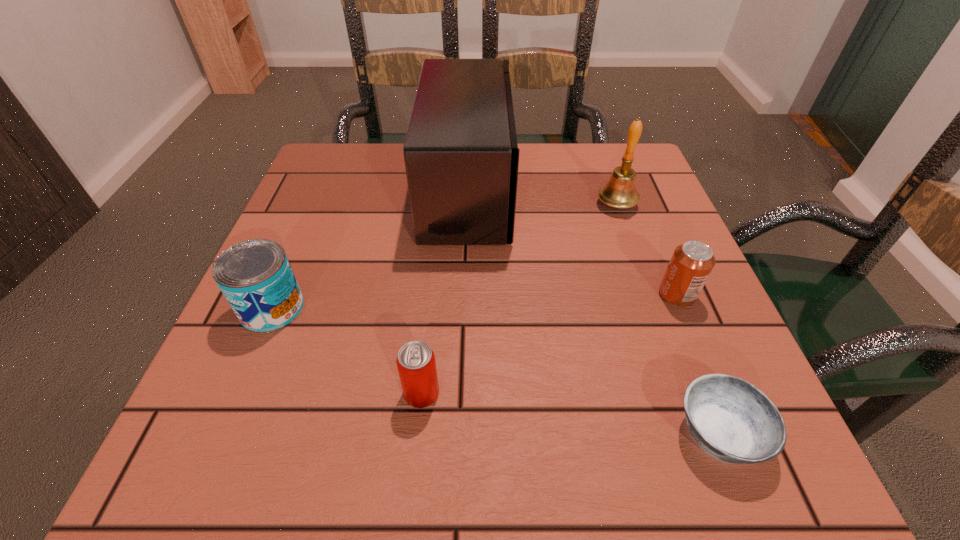
Find the location of a particular element. free space between the bell and the leftmost object is located at coordinates (444, 256).

At what (x,y) coordinates should I click in order to perform the action: click on vacant space that is in between the microwave_oven and the rightmost can. Please return your answer as a coordinate pair (x, y). Looking at the image, I should click on (572, 242).

This screenshot has width=960, height=540. Identify the location of vacant area that lies between the microwave_oven and the second can from right to left. (444, 291).

You are a GUI agent. You are given a task and a screenshot of the screen. Output one action in this format:
    pyautogui.click(x=<x>, y=<y>)
    Task: Click on the free space that is in between the leftmost can and the shortest object
    The width and height of the screenshot is (960, 540).
    Given the screenshot: What is the action you would take?
    pyautogui.click(x=495, y=370)

Image resolution: width=960 pixels, height=540 pixels. What are the coordinates of `free spot between the nearest can and the leftmost object` in the screenshot? It's located at (347, 350).

Identify the location of blank region between the microwave_oven and the leftmost object. This screenshot has height=540, width=960. (371, 249).

This screenshot has width=960, height=540. In order to click on vacant point located between the microwave_oven and the rightmost can in this screenshot , I will do 572,242.

At what (x,y) coordinates should I click in order to perform the action: click on the closest object to the microwave_oven. Please return your answer as a coordinate pair (x, y). This screenshot has height=540, width=960. Looking at the image, I should click on (619, 192).

Locate which object ranks fourth in proximity to the leftmost can. Please provide its 2D coordinates. Your answer should be formatted as a tuple, i.e. [(x, y)], where the tuple contains the x and y coordinates of a point satisfying the conditions above.

[(619, 192)]

Where is `can that is the second closest to the second can from left to right`? can that is the second closest to the second can from left to right is located at coordinates (692, 262).